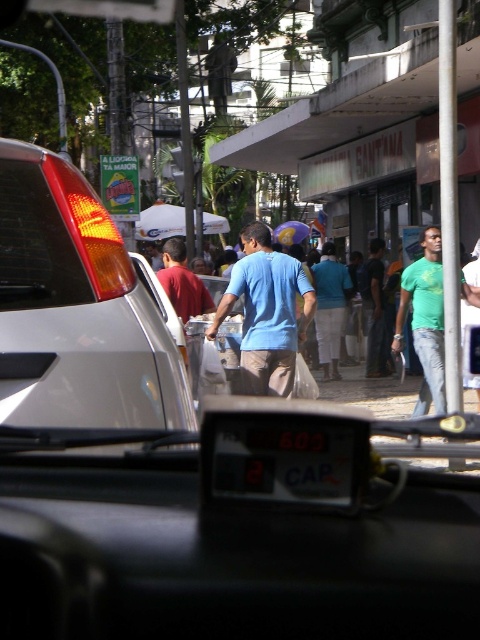
What is located at the coordinates point (287,460) in the image?

The point (287,460) indicates a black plastic license plate at center.